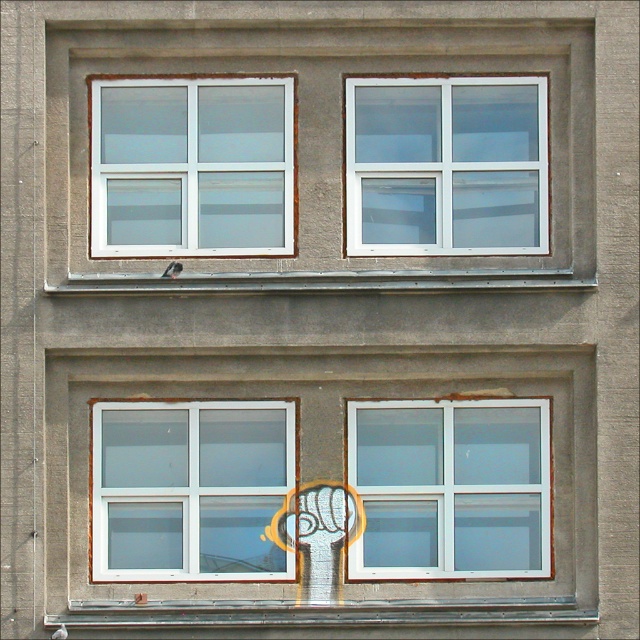
Question: Can you confirm if white plastic window at upper left is bigger than white glass window at lower center?

Choices:
 (A) no
 (B) yes

Answer: (B)

Question: Estimate the real-world distances between objects in this image. Which object is farther from the white glass window at lower left?

Choices:
 (A) white glass window at lower center
 (B) white plastic window at upper left

Answer: (B)

Question: Can you confirm if white plastic window at upper right is smaller than white glass window at lower center?

Choices:
 (A) yes
 (B) no

Answer: (B)

Question: Which point is farther to the camera?

Choices:
 (A) (467, 461)
 (B) (452, 144)
 (C) (109, 486)
 (D) (166, 188)

Answer: (D)

Question: Based on their relative distances, which object is nearer to the white plastic window at upper right?

Choices:
 (A) white plastic window at upper left
 (B) white glass window at lower center

Answer: (A)

Question: Does white plastic window at upper left have a larger size compared to white glass window at lower left?

Choices:
 (A) yes
 (B) no

Answer: (A)